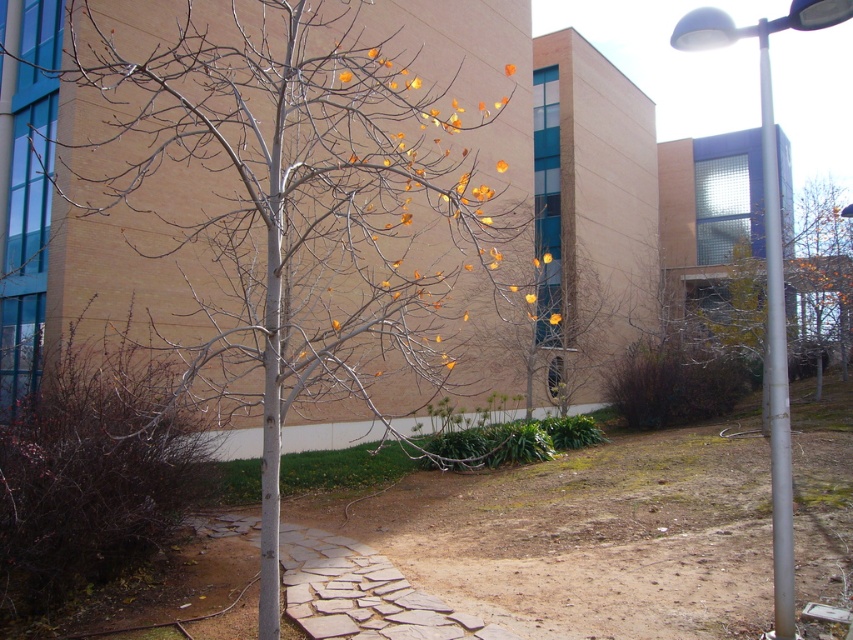
You are a maintenance worker needing to inspect the white metallic pole at right. From your current position at the smooth gray tree at center, which direction should you move to reach the pole?

The smooth gray tree at center is positioned under the white metallic pole at right, so you should move towards the right direction to reach the pole.

You are standing at the camera position looking at the outdoor scene with the modern building. There is a point marked at coordinates point (196,364). Can you estimate how far this point is from your current position?

The point (196,364) is 11.75 feet away from the camera, so the distance is approximately 11.75 feet.

You are standing at the entrance of the modern building and want to walk to the smooth gray tree at center. There is a white metallic pole at right nearby. Which object is closer to you as you start walking?

The smooth gray tree at center is closer to the viewer than the white metallic pole at right, so the smooth gray tree at center is closer to you as you start walking.